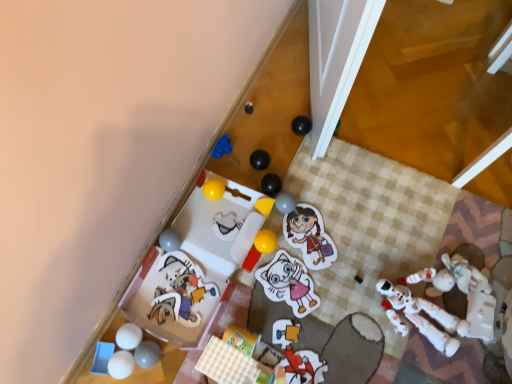
Identify the location of vacant space that's between white matte cat at center, which is counted as the 2th toy, starting from the right, and rubber matte ball at center, which ranks as the thirteenth toy in left-to-right order. This screenshot has width=512, height=384. (291, 246).